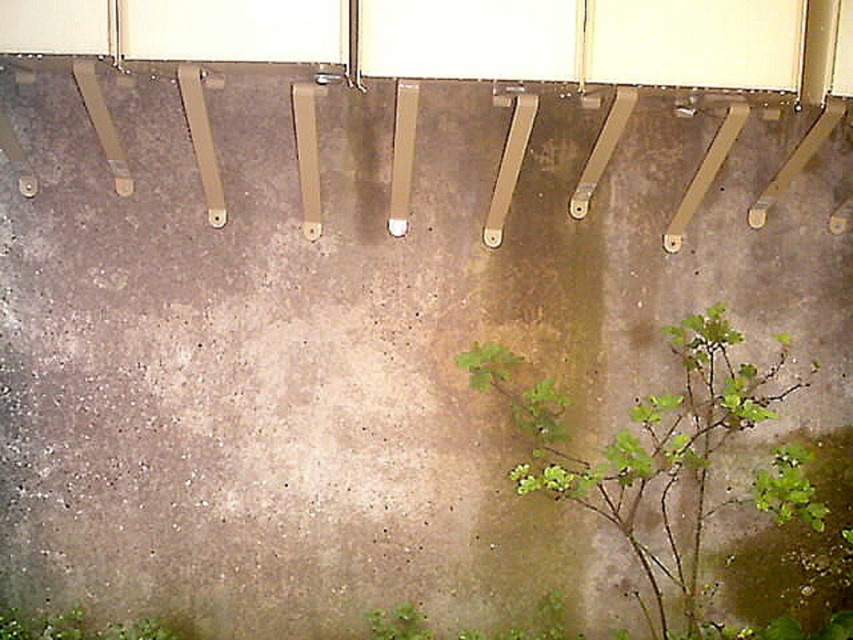
You are standing at the camera position and want to water the green leafy plant at lower right. If your watering can has a maximum reach of 3 meters, will you be able to water it without moving closer?

The distance between you and the green leafy plant at lower right is 3.60 meters, which exceeds the watering can reach of 3 meters. Therefore, you need to move closer to water it.

In the scene shown: You are a drone operator trying to navigate between two points on a concrete wall. You need to fly from point A to point B. Given that point A is at point (689, 470) and point B is at point (416, 634), which point is closer to you when you are facing the wall?

Point A at point (689, 470) is closer to you because it is further to the viewer than point B at point (416, 634).